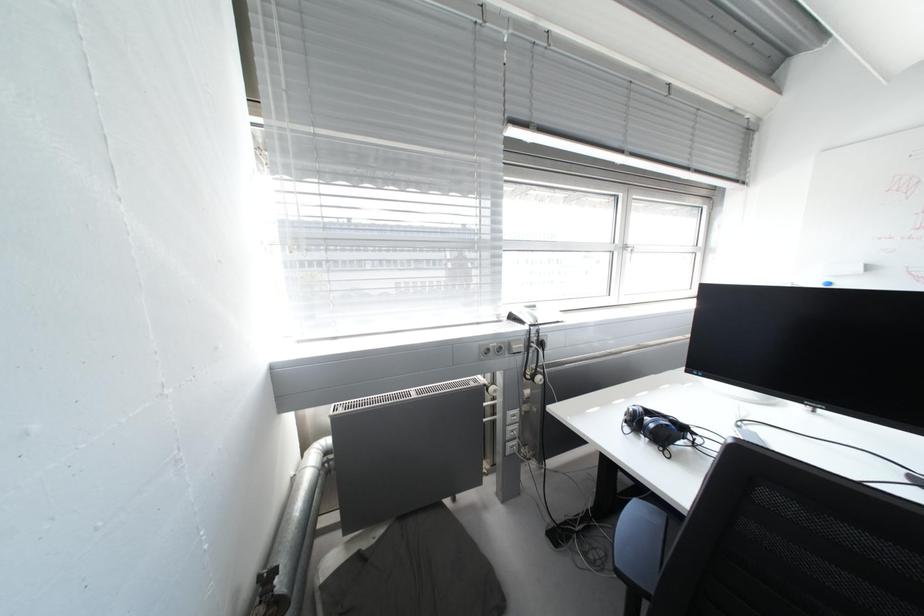
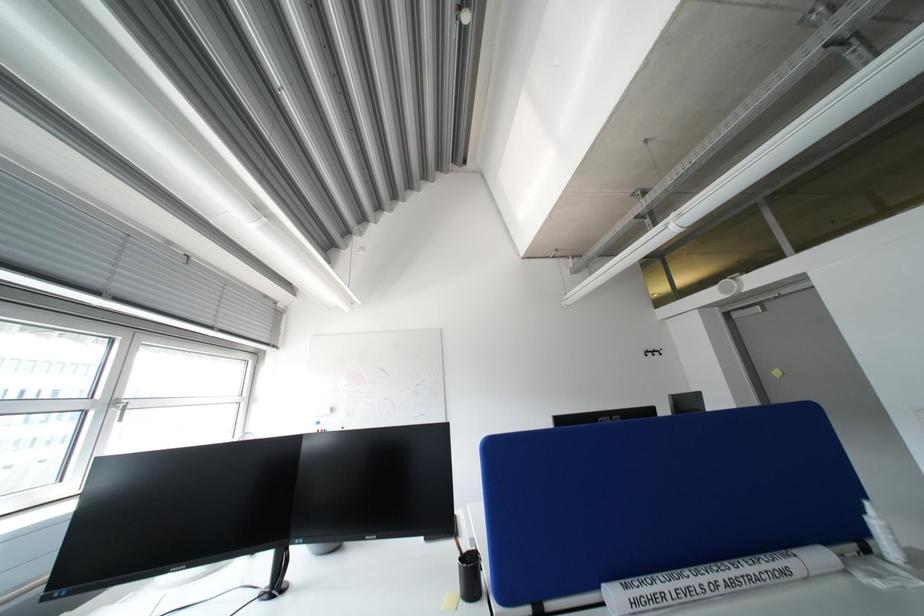
First-person continuous shooting, in which direction is the camera rotating?

The camera's rotation is toward right-up.